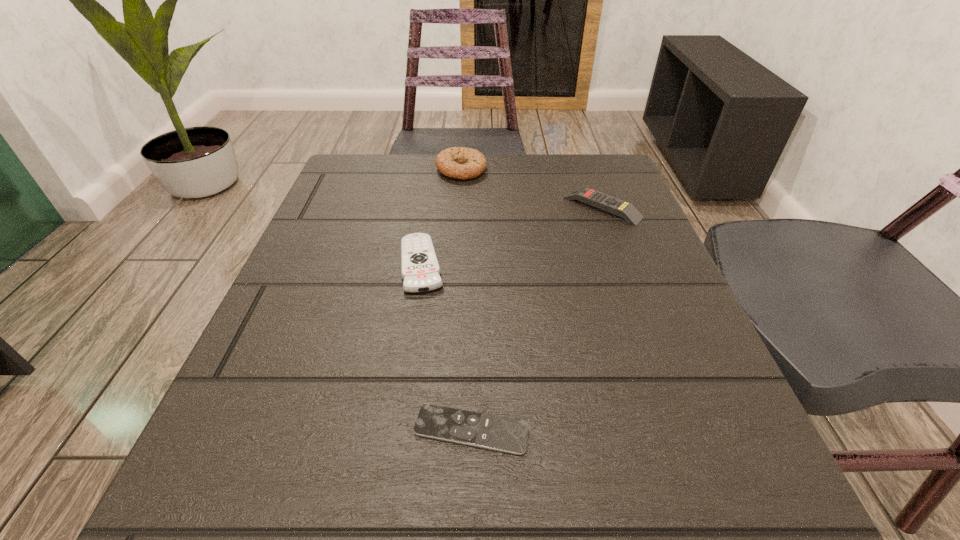
The image size is (960, 540). I want to click on vacant region at the far left corner, so click(x=347, y=194).

At what (x,y) coordinates should I click in order to perform the action: click on blank space at the near left corner of the desktop. Please return your answer as a coordinate pair (x, y). Image resolution: width=960 pixels, height=540 pixels. Looking at the image, I should click on (214, 471).

Where is `free spot at the near right corner of the desktop`? This screenshot has height=540, width=960. free spot at the near right corner of the desktop is located at coordinates (669, 463).

Image resolution: width=960 pixels, height=540 pixels. I want to click on vacant space that is in between the third farthest object and the shortest object, so click(x=446, y=347).

This screenshot has width=960, height=540. In order to click on vacant space in between the farthest remote control and the nearest object in this screenshot , I will do `click(537, 319)`.

Locate an element on the screen. Image resolution: width=960 pixels, height=540 pixels. vacant region between the tallest remote control and the second farthest remote control is located at coordinates (512, 236).

Identify the location of empty location between the farthest remote control and the second nearest remote control. The image size is (960, 540). (512, 236).

The height and width of the screenshot is (540, 960). I want to click on free space that is in between the shortest remote control and the tallest remote control, so click(537, 319).

The width and height of the screenshot is (960, 540). Identify the location of vacant area that lies between the nearest object and the second tallest object. (537, 319).

Where is `free space between the shortest object and the third shortest object`? The image size is (960, 540). free space between the shortest object and the third shortest object is located at coordinates (537, 319).